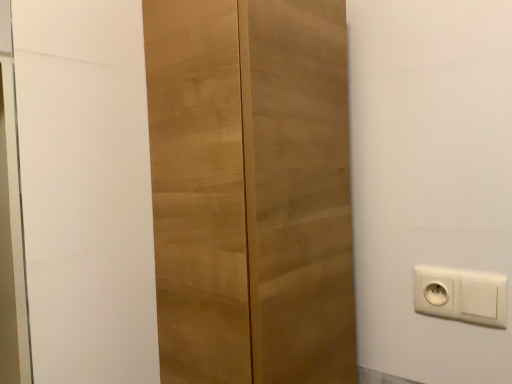
Question: Is light wood cupboard at center placed right next to white plastic power plugs and sockets at lower right?

Choices:
 (A) yes
 (B) no

Answer: (B)

Question: Does light wood cupboard at center have a lesser width compared to white plastic power plugs and sockets at lower right?

Choices:
 (A) yes
 (B) no

Answer: (B)

Question: Considering the relative positions of light wood cupboard at center and white plastic power plugs and sockets at lower right in the image provided, is light wood cupboard at center to the left of white plastic power plugs and sockets at lower right from the viewer's perspective?

Choices:
 (A) no
 (B) yes

Answer: (B)

Question: Is light wood cupboard at center positioned with its back to white plastic power plugs and sockets at lower right?

Choices:
 (A) no
 (B) yes

Answer: (A)

Question: Does light wood cupboard at center have a smaller size compared to white plastic power plugs and sockets at lower right?

Choices:
 (A) yes
 (B) no

Answer: (B)

Question: Is the depth of light wood cupboard at center less than that of white plastic power plugs and sockets at lower right?

Choices:
 (A) yes
 (B) no

Answer: (A)

Question: Does white plastic power plugs and sockets at lower right come in front of light wood cupboard at center?

Choices:
 (A) no
 (B) yes

Answer: (A)

Question: Does white plastic power plugs and sockets at lower right have a greater width compared to light wood cupboard at center?

Choices:
 (A) no
 (B) yes

Answer: (A)

Question: Is white plastic power plugs and sockets at lower right oriented away from light wood cupboard at center?

Choices:
 (A) yes
 (B) no

Answer: (B)

Question: Considering the relative sizes of white plastic power plugs and sockets at lower right and light wood cupboard at center in the image provided, is white plastic power plugs and sockets at lower right shorter than light wood cupboard at center?

Choices:
 (A) yes
 (B) no

Answer: (A)

Question: From a real-world perspective, is white plastic power plugs and sockets at lower right physically below light wood cupboard at center?

Choices:
 (A) yes
 (B) no

Answer: (A)

Question: Does white plastic power plugs and sockets at lower right have a smaller size compared to light wood cupboard at center?

Choices:
 (A) yes
 (B) no

Answer: (A)

Question: Is point (223, 329) closer or farther from the camera than point (488, 307)?

Choices:
 (A) farther
 (B) closer

Answer: (B)